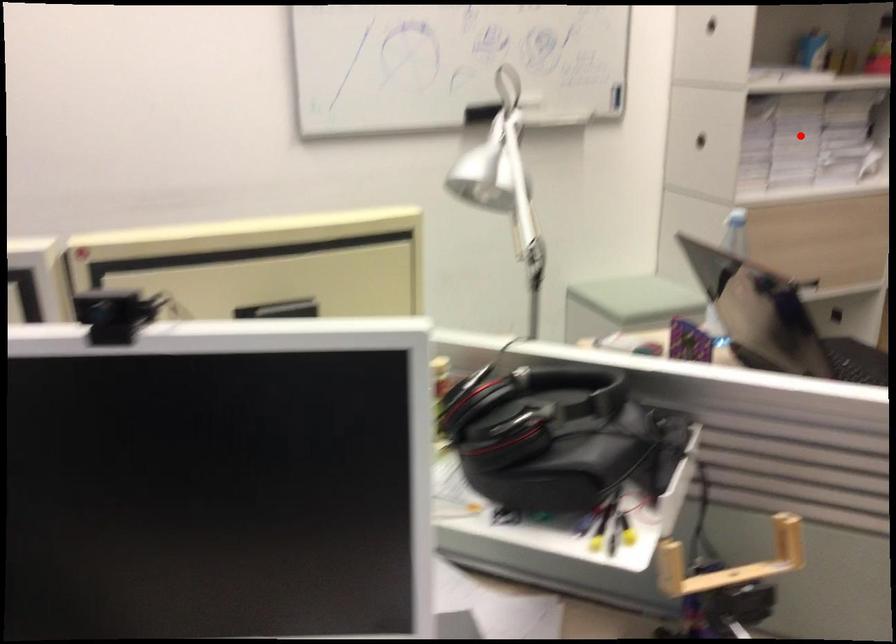
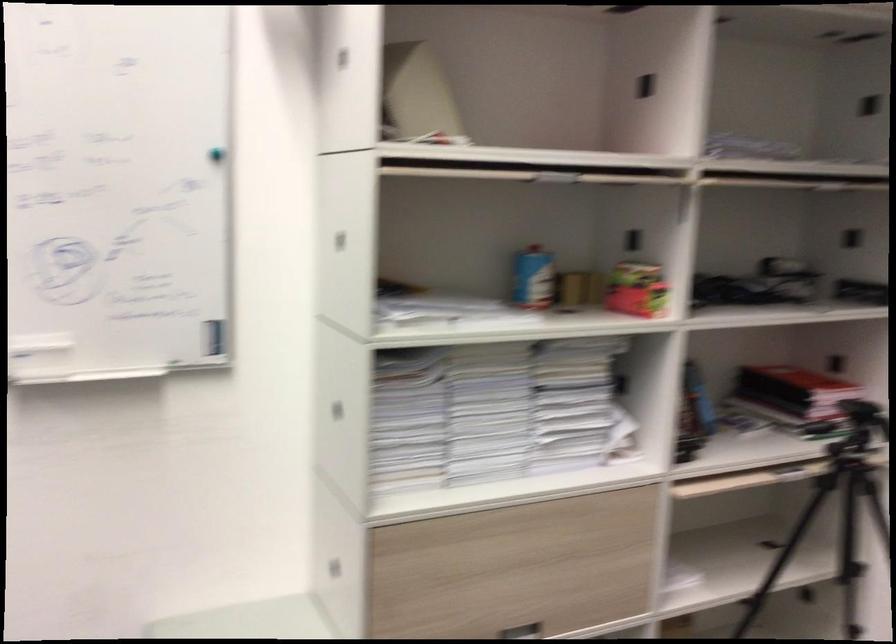
Where in the second image is the point corresponding to the highlighted location from the first image?

(489, 412)